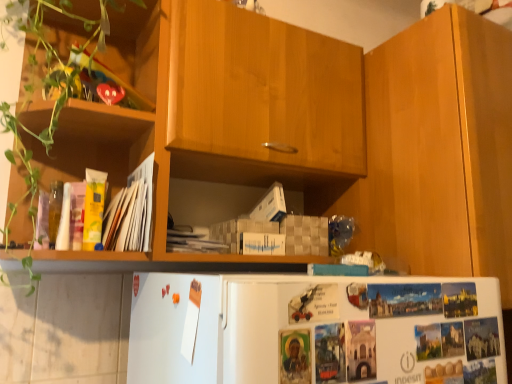
Measure the distance between point (504, 254) and camera.

36.73 inches.

What is the approximate height of wooden cabinet at right?

It is 28.90 inches.

The width and height of the screenshot is (512, 384). Describe the element at coordinates (131, 212) in the screenshot. I see `yellow paper at left` at that location.

Locate an element on the screen. The height and width of the screenshot is (384, 512). green matte plant at left is located at coordinates (105, 115).

Which object is more forward, wooden cabinet at right or green matte plant at left?

green matte plant at left is in front.

What's the angular difference between wooden cabinet at right and green matte plant at left's facing directions?

The angular difference between wooden cabinet at right and green matte plant at left is 0.00243 degrees.

The width and height of the screenshot is (512, 384). Identify the location of cabinetry lying on the right of green matte plant at left. (443, 146).

How far apart are wooden cabinet at right and green matte plant at left?

wooden cabinet at right and green matte plant at left are 28.36 inches apart from each other.

Considering the sizes of green matte plant at left and wooden cabinet at right in the image, is green matte plant at left bigger or smaller than wooden cabinet at right?

In the image, green matte plant at left appears to be smaller than wooden cabinet at right.

Looking at this image, in the image, is green matte plant at left positioned in front of or behind wooden cabinet at right?

green matte plant at left is in front of wooden cabinet at right.

Where is `shelf above the wooden cabinet at right (from a real-world perspective)`? shelf above the wooden cabinet at right (from a real-world perspective) is located at coordinates point(105,115).

Considering the relative sizes of yellow paper at left and wooden cabinet at right in the image provided, is yellow paper at left bigger than wooden cabinet at right?

Actually, yellow paper at left might be smaller than wooden cabinet at right.

Is yellow paper at left facing towards wooden cabinet at right?

No.

From the image's perspective, is yellow paper at left below wooden cabinet at right?

Correct, yellow paper at left appears lower than wooden cabinet at right in the image.

Considering the relative positions of yellow paper at left and wooden cabinet at right in the image provided, is yellow paper at left in front of wooden cabinet at right?

Yes, yellow paper at left is closer to the viewer.

From the image's perspective, is wooden cabinet at right under yellow paper at left?

No.

Can you confirm if wooden cabinet at right is positioned to the left of yellow paper at left?

No, wooden cabinet at right is not to the left of yellow paper at left.

Which of these two, wooden cabinet at right or yellow paper at left, stands taller?

wooden cabinet at right is taller.

From a real-world perspective, which is physically below, wooden cabinet at right or yellow paper at left?

yellow paper at left, from a real-world perspective.

Visually, is green matte plant at left positioned to the left or to the right of yellow paper at left?

In the image, green matte plant at left appears on the left side of yellow paper at left.

Where is `shelf in front of the yellow paper at left`? This screenshot has height=384, width=512. shelf in front of the yellow paper at left is located at coordinates (105, 115).

Is green matte plant at left in front of or behind yellow paper at left in the image?

Visually, green matte plant at left is located in front of yellow paper at left.

Looking at their sizes, would you say green matte plant at left is wider or thinner than yellow paper at left?

Considering their sizes, green matte plant at left looks broader than yellow paper at left.

From the image's perspective, is yellow paper at left above green matte plant at left?

No.

Does yellow paper at left have a larger size compared to green matte plant at left?

No, yellow paper at left is not bigger than green matte plant at left.

Looking at this image, is yellow paper at left to the right of green matte plant at left from the viewer's perspective?

Correct, you'll find yellow paper at left to the right of green matte plant at left.

From a real-world perspective, is yellow paper at left positioned above or below green matte plant at left?

yellow paper at left is situated lower than green matte plant at left in the real world.

Locate an element on the screen. The image size is (512, 384). cabinetry lying behind the green matte plant at left is located at coordinates (443, 146).

The image size is (512, 384). What are the coordinates of `cabinetry that appears below the green matte plant at left (from the image's perspective)` in the screenshot? It's located at (443, 146).

Which object lies further to the anchor point green matte plant at left, wooden cabinet at right or yellow paper at left?

The object further to green matte plant at left is wooden cabinet at right.

When comparing their distances from wooden cabinet at right, does green matte plant at left or yellow paper at left seem closer?

Based on the image, yellow paper at left appears to be nearer to wooden cabinet at right.

Looking at the image, which one is located closer to yellow paper at left, green matte plant at left or wooden cabinet at right?

Among the two, green matte plant at left is located nearer to yellow paper at left.

From the image, which object appears to be nearer to yellow paper at left, wooden cabinet at right or green matte plant at left?

green matte plant at left lies closer to yellow paper at left than the other object.

Which object lies further to the anchor point green matte plant at left, yellow paper at left or wooden cabinet at right?

wooden cabinet at right lies further to green matte plant at left than the other object.

From the image, which object appears to be nearer to wooden cabinet at right, yellow paper at left or green matte plant at left?

Based on the image, yellow paper at left appears to be nearer to wooden cabinet at right.

The height and width of the screenshot is (384, 512). In order to click on magazine located between green matte plant at left and wooden cabinet at right in the left-right direction in this screenshot , I will do `click(131, 212)`.